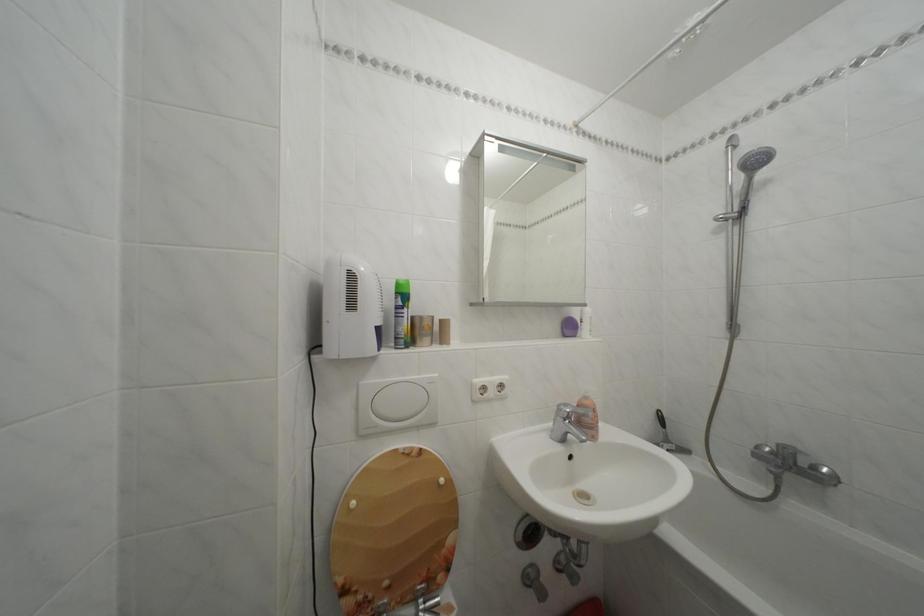
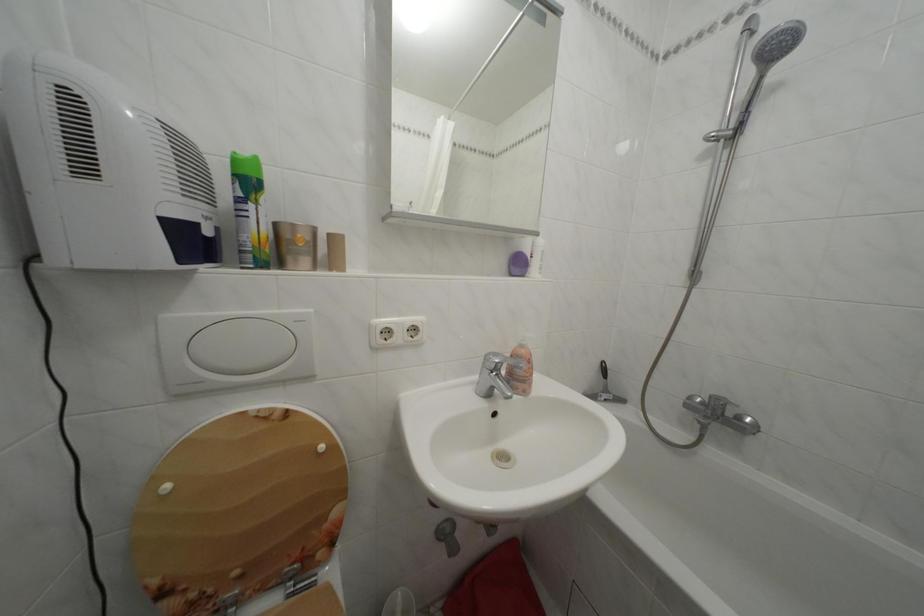
Locate, in the second image, the point that corresponds to [745,216] in the first image.

(742, 132)